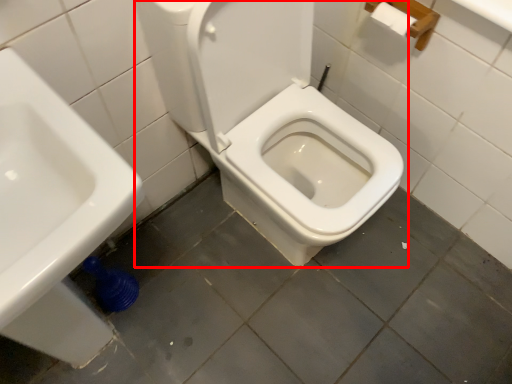
Question: From the image's perspective, where is toilet (annotated by the red box) located relative to sink?

Choices:
 (A) below
 (B) above

Answer: (B)